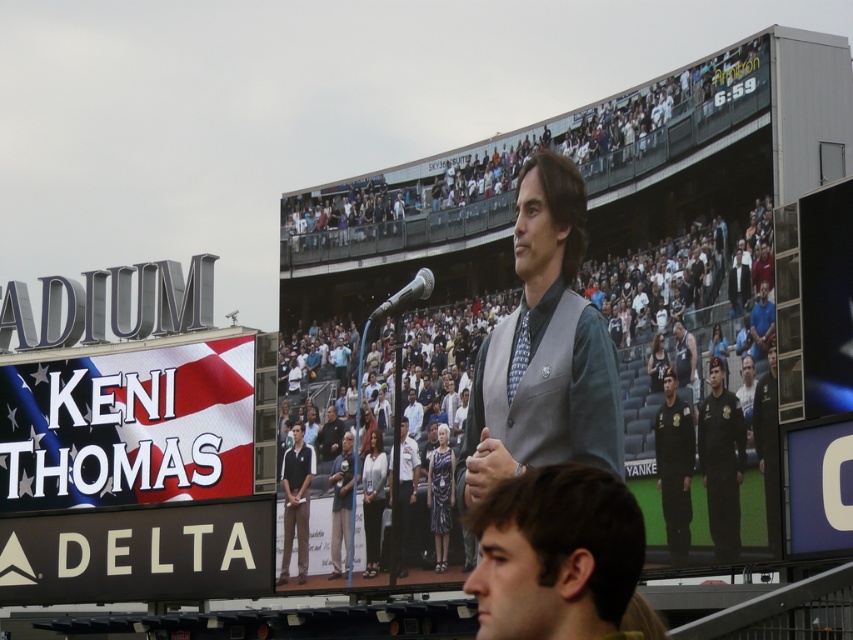
Who is taller, gray fabric vest at center or dark brown hair at lower center?

gray fabric vest at center is taller.

Who is more distant from viewer, (492, 400) or (498, 625)?

Positioned behind is point (492, 400).

This screenshot has width=853, height=640. I want to click on gray fabric vest at center, so click(x=543, y=349).

Can you confirm if blue plastic letter o at center is taller than black fabric uniform at center?

In fact, blue plastic letter o at center may be shorter than black fabric uniform at center.

Can you confirm if blue plastic letter o at center is thinner than black fabric uniform at center?

Indeed, blue plastic letter o at center has a lesser width compared to black fabric uniform at center.

Between point (793, 516) and point (665, 540), which one is positioned in front?

Positioned in front is point (793, 516).

The width and height of the screenshot is (853, 640). I want to click on blue plastic letter o at center, so click(817, 486).

Between point (242, 376) and point (498, 534), which one is positioned behind?

The point (242, 376) is more distant.

Between white fabric sign at left and dark brown hair at lower center, which one has less height?

Standing shorter between the two is white fabric sign at left.

In order to click on white fabric sign at left in this screenshot , I will do `click(126, 428)`.

Where is `white fabric sign at left`? white fabric sign at left is located at coordinates (126, 428).